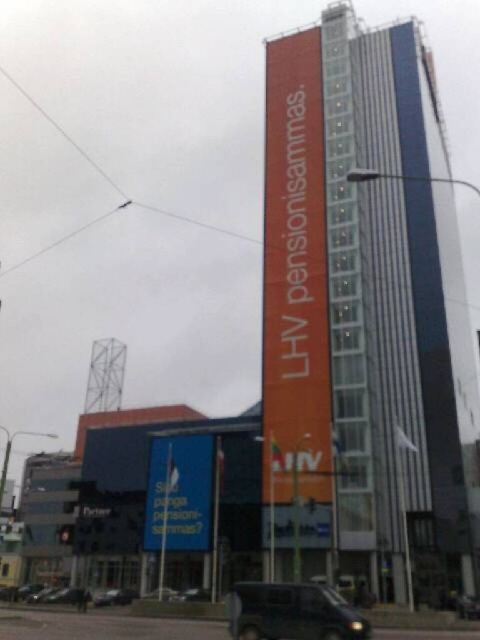
Which is more to the right, orange glass tower at center or metallic silver car at lower center?

orange glass tower at center is more to the right.

Can you confirm if orange glass tower at center is wider than metallic silver car at lower center?

Correct, the width of orange glass tower at center exceeds that of metallic silver car at lower center.

Locate an element on the screen. orange glass tower at center is located at coordinates (367, 288).

Can you confirm if orange glass tower at center is taller than dark gray matte van at lower center?

Indeed, orange glass tower at center has a greater height compared to dark gray matte van at lower center.

Is the position of orange glass tower at center more distant than that of dark gray matte van at lower center?

Yes.

This screenshot has width=480, height=640. In order to click on orange glass tower at center in this screenshot , I will do `click(367, 288)`.

Image resolution: width=480 pixels, height=640 pixels. Identify the location of orange glass tower at center. (367, 288).

Which is more to the left, dark gray matte van at lower center or metallic lattice tower at center?

From the viewer's perspective, metallic lattice tower at center appears more on the left side.

Does dark gray matte van at lower center come behind metallic lattice tower at center?

No.

Who is more distant from viewer, (247, 588) or (101, 352)?

The point (101, 352) is more distant.

The width and height of the screenshot is (480, 640). Identify the location of dark gray matte van at lower center. (291, 612).